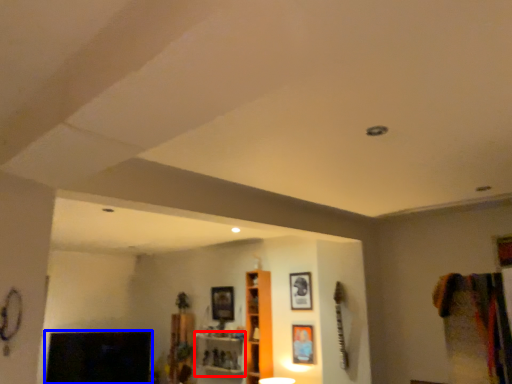
Question: Which of the following is the closest to the observer, shelf (highlighted by a red box) or fireplace (highlighted by a blue box)?

Choices:
 (A) shelf
 (B) fireplace

Answer: (A)